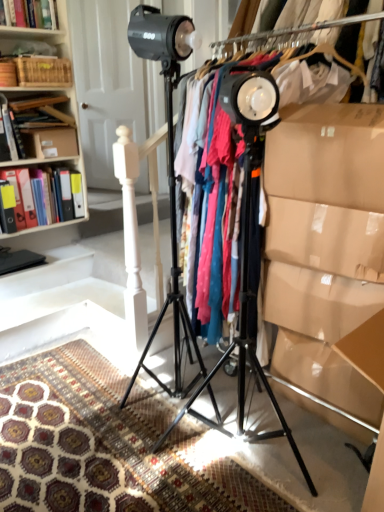
Question: Can you confirm if matte plastic folders at left, which is the 2th book from bottom to top, is shorter than hardcover book at upper left, positioned as the 3th book in bottom-to-top order?

Choices:
 (A) no
 (B) yes

Answer: (A)

Question: From the image's perspective, would you say matte plastic folders at left, which is the 2th book from bottom to top, is positioned over hardcover book at upper left, the 1th book when ordered from top to bottom?

Choices:
 (A) yes
 (B) no

Answer: (B)

Question: Is matte plastic folders at left, positioned as the second book in top-to-bottom order, far from hardcover book at upper left, the 1th book when ordered from top to bottom?

Choices:
 (A) yes
 (B) no

Answer: (B)

Question: Is hardcover book at upper left, positioned as the 3th book in bottom-to-top order, at the back of matte plastic folders at left, positioned as the second book in top-to-bottom order?

Choices:
 (A) yes
 (B) no

Answer: (B)

Question: Can you confirm if matte plastic folders at left, positioned as the second book in top-to-bottom order, is smaller than hardcover book at upper left, positioned as the 3th book in bottom-to-top order?

Choices:
 (A) yes
 (B) no

Answer: (B)

Question: Is matte plastic folders at left, positioned as the second book in top-to-bottom order, at the left side of hardcover book at upper left, the 1th book when ordered from top to bottom?

Choices:
 (A) no
 (B) yes

Answer: (B)

Question: Considering the relative sizes of black matte tripod at center, placed as the first tripod when sorted from right to left, and hardcover book at upper left, positioned as the 3th book in bottom-to-top order, in the image provided, is black matte tripod at center, placed as the first tripod when sorted from right to left, wider than hardcover book at upper left, positioned as the 3th book in bottom-to-top order,?

Choices:
 (A) no
 (B) yes

Answer: (B)

Question: Considering the relative sizes of black matte tripod at center, the 2th tripod when ordered from left to right, and hardcover book at upper left, positioned as the 3th book in bottom-to-top order, in the image provided, is black matte tripod at center, the 2th tripod when ordered from left to right, smaller than hardcover book at upper left, positioned as the 3th book in bottom-to-top order,?

Choices:
 (A) yes
 (B) no

Answer: (B)

Question: From a real-world perspective, is black matte tripod at center, the 2th tripod when ordered from left to right, on top of hardcover book at upper left, positioned as the 3th book in bottom-to-top order?

Choices:
 (A) no
 (B) yes

Answer: (A)

Question: Are black matte tripod at center, the 2th tripod when ordered from left to right, and hardcover book at upper left, the 1th book when ordered from top to bottom, far apart?

Choices:
 (A) no
 (B) yes

Answer: (B)

Question: Considering the relative sizes of black matte tripod at center, the 2th tripod when ordered from left to right, and hardcover book at upper left, the 1th book when ordered from top to bottom, in the image provided, is black matte tripod at center, the 2th tripod when ordered from left to right, thinner than hardcover book at upper left, the 1th book when ordered from top to bottom,?

Choices:
 (A) yes
 (B) no

Answer: (B)

Question: Is hardcover book at upper left, the 1th book when ordered from top to bottom, at the back of black matte tripod at center, the 2th tripod when ordered from left to right?

Choices:
 (A) yes
 (B) no

Answer: (B)

Question: Does black matte tripod at center, which is the first tripod from left to right, have a smaller size compared to matte plastic folders at left, which is the 2th book from bottom to top?

Choices:
 (A) no
 (B) yes

Answer: (A)